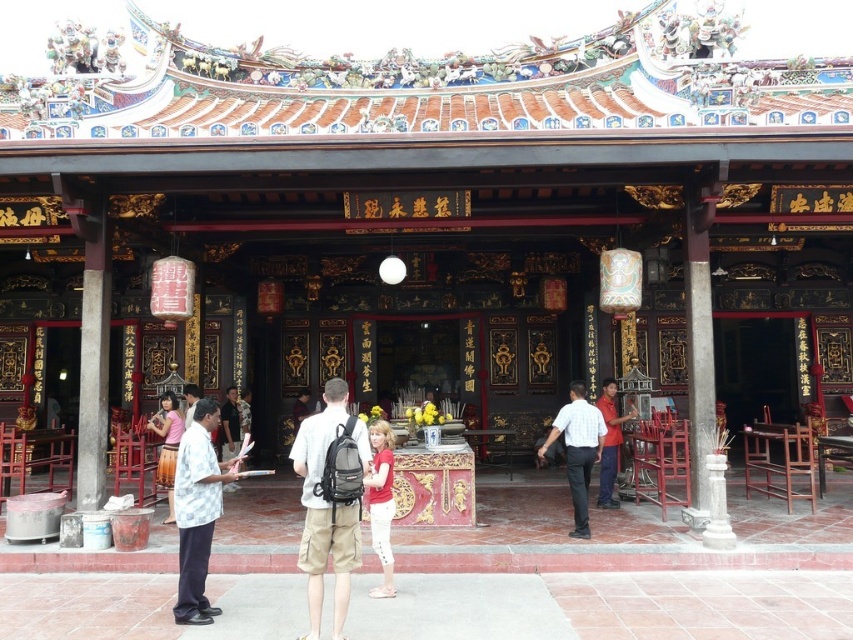
You are a visitor at the temple and want to take a photo of both the khaki cargo shorts at center and the pink fabric shirt at lower left. Which object should you focus on first to ensure both are in frame?

You should focus on the khaki cargo shorts at center first since it is taller than the pink fabric shirt at lower left, ensuring both are visible in the photo.

You are standing in front of the traditional Chinese temple and notice two points marked on the facade. The first point is at coordinates point [381,460] and the second is at point [155,422]. Which of these points is nearer to your current position?

Point [381,460] is closer to the viewer than point [155,422], so the first point is nearer to your current position.